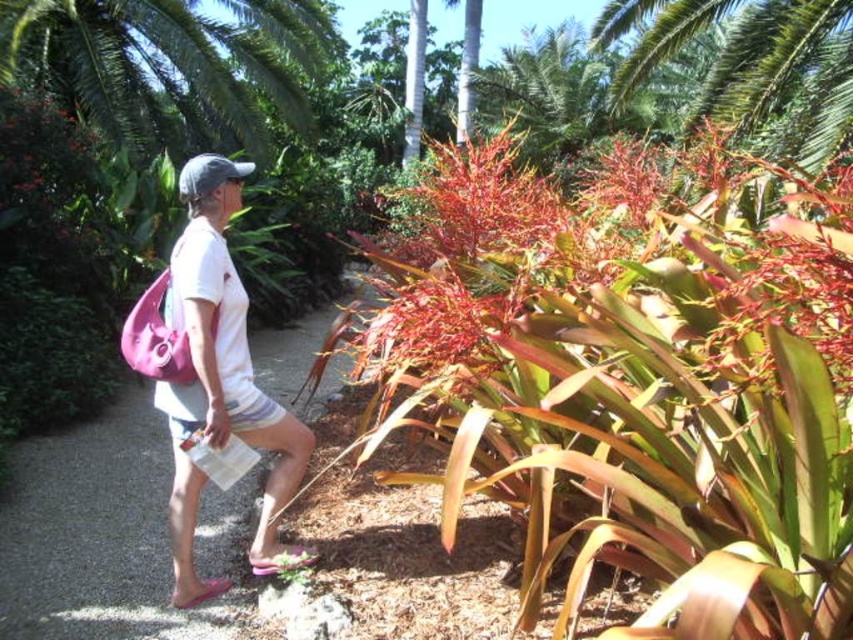
Which is behind, point (183, 122) or point (294, 442)?

The point (183, 122) is more distant.

Consider the image. Can you confirm if green leafy palm tree at upper center is smaller than white fabric shirt at center?

No.

Between point (198, 44) and point (180, 458), which one is positioned behind?

Positioned behind is point (198, 44).

Locate an element on the screen. The height and width of the screenshot is (640, 853). green leafy palm tree at upper center is located at coordinates (172, 65).

Does pink fabric bag at left have a greater width compared to white fabric shirt at center?

Correct, the width of pink fabric bag at left exceeds that of white fabric shirt at center.

Who is more forward, (x=51, y=548) or (x=262, y=541)?

Point (x=262, y=541) is more forward.

Identify the location of pink fabric bag at left. (113, 536).

Can you confirm if pink fabric bag at left is bigger than green leafy palm tree at upper center?

No.

Is pink fabric bag at left shorter than green leafy palm tree at upper center?

Yes.

Locate an element on the screen. The height and width of the screenshot is (640, 853). pink fabric bag at left is located at coordinates (113, 536).

Locate an element on the screen. pink fabric bag at left is located at coordinates (113, 536).